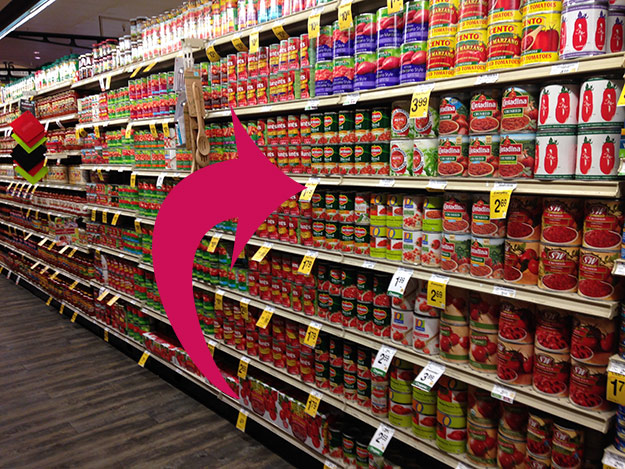
You are a GUI agent. You are given a task and a screenshot of the screen. Output one action in this format:
    pyautogui.click(x=<x>, y=<y>)
    Task: Click on the yellow price tag on second shelf, left side
    The height and width of the screenshot is (469, 625).
    Given the screenshot: What is the action you would take?
    pyautogui.click(x=504, y=206)